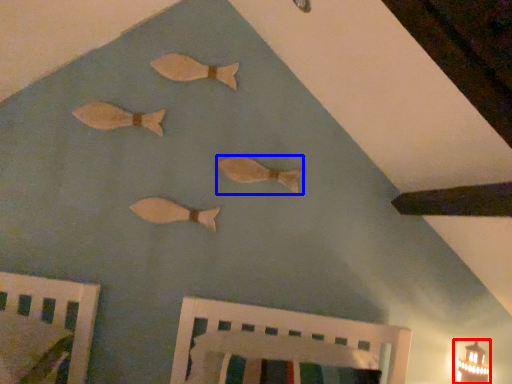
Question: Which point is further to the camera, light fixture (highlighted by a red box) or fish (highlighted by a blue box)?

Choices:
 (A) light fixture
 (B) fish

Answer: (B)